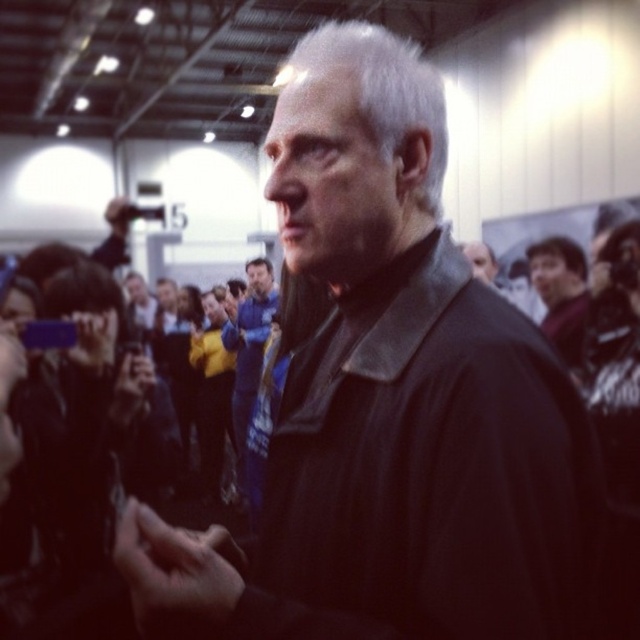
You are organizing a photo shoot and need to ensure that all participants are visible in the frame. Given the blue fabric shirt at center and the dark blue shirt at right, which one might be easier to capture in a wider shot due to its size?

The dark blue shirt at right is larger and occupies more space, making it easier to capture in a wider shot compared to the smaller blue fabric shirt at center.

You are standing in the crowd at the event and want to move from point A to point B. Point A is at coordinates point (403, 38) and point B is at coordinates point (556, 321). Which point is closer to you?

Point (403, 38) is closer to you than point (556, 321) because it is further to the viewer.